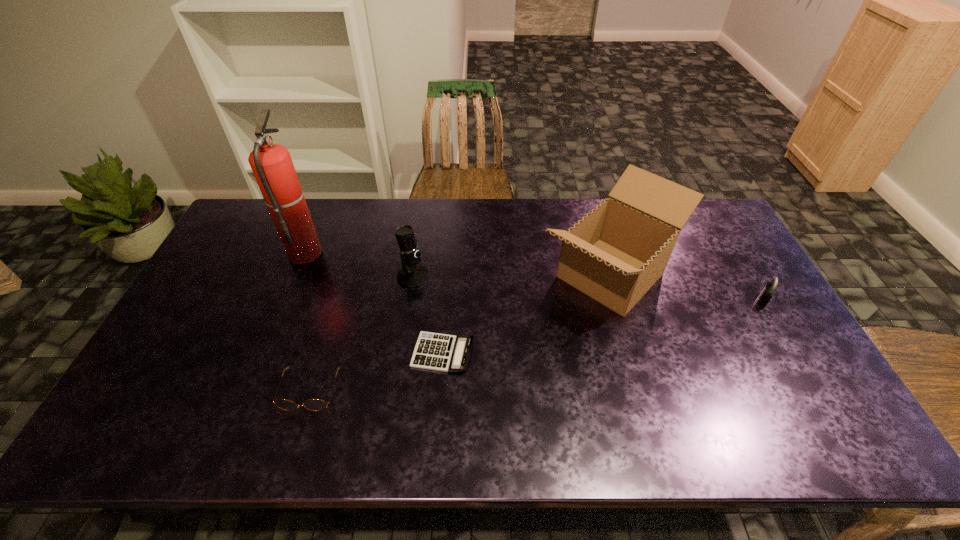
At what (x,y) coordinates should I click in order to perform the action: click on vacant space located 0.120m with the nozzle and gauge on the tallest object. Please return your answer as a coordinate pair (x, y). The image size is (960, 540). Looking at the image, I should click on (358, 251).

Locate an element on the screen. vacant region located 0.150m on the back of the fifth shortest object is located at coordinates (588, 201).

Image resolution: width=960 pixels, height=540 pixels. In order to click on free space located 0.370m on the right of the microphone in this screenshot , I will do `click(547, 276)`.

Where is `vacant space located 0.260m on the front of the third shortest object`? vacant space located 0.260m on the front of the third shortest object is located at coordinates (814, 387).

Where is `vacant space positioned 0.250m on the left of the calculator`? vacant space positioned 0.250m on the left of the calculator is located at coordinates (318, 353).

You are a GUI agent. You are given a task and a screenshot of the screen. Output one action in this format:
    pyautogui.click(x=<x>, y=<y>)
    Task: Click on the fire extinguisher located at the far edge
    
    Given the screenshot: What is the action you would take?
    pyautogui.click(x=272, y=166)

I want to click on box present at the far edge, so click(x=614, y=254).

This screenshot has width=960, height=540. In order to click on object positioned at the right edge in this screenshot , I will do `click(766, 294)`.

The image size is (960, 540). In order to click on vacant space at the far edge of the desktop in this screenshot , I will do `click(450, 201)`.

This screenshot has width=960, height=540. I want to click on blank space at the near edge of the desktop, so click(x=197, y=426).